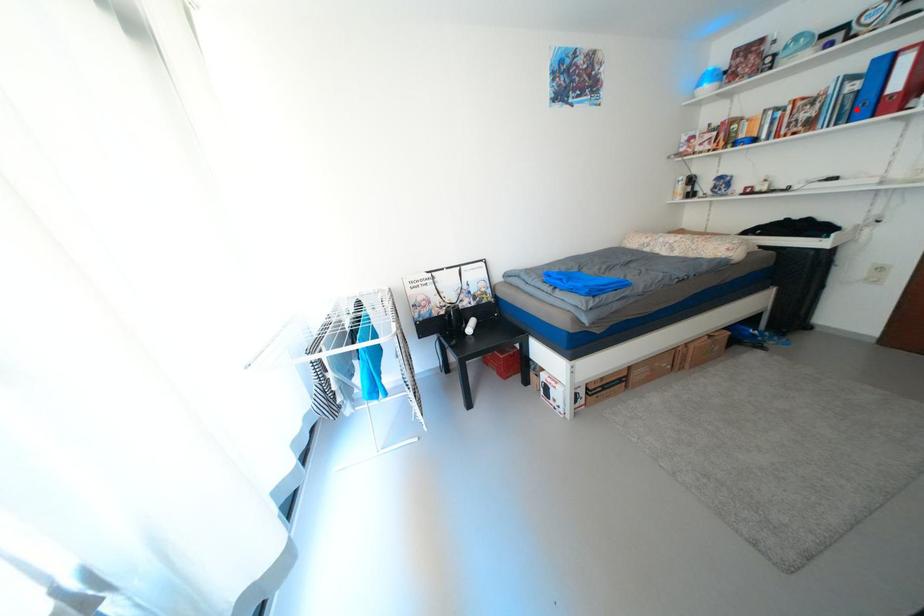
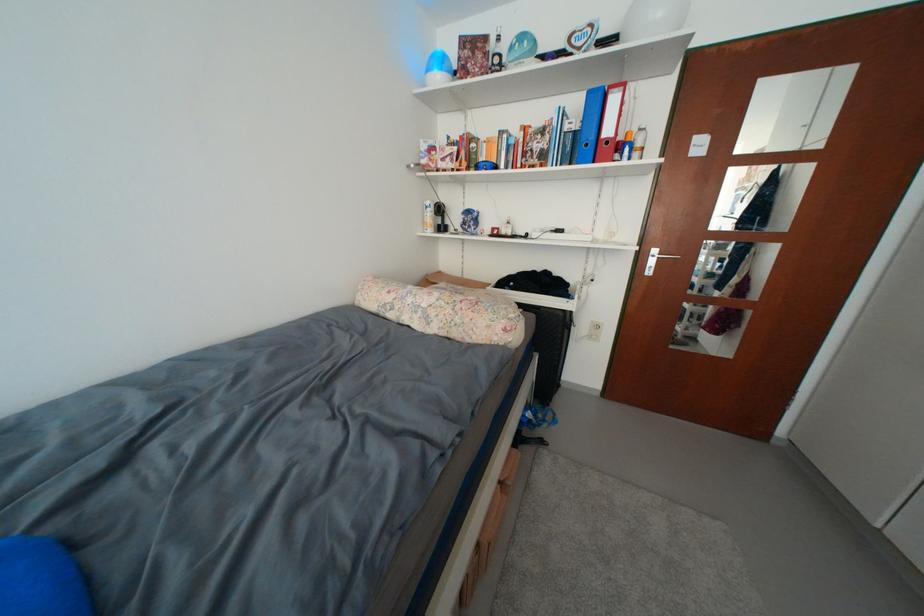
Locate, in the second image, the point that corresponds to the highlighted location in the first image.

(578, 151)